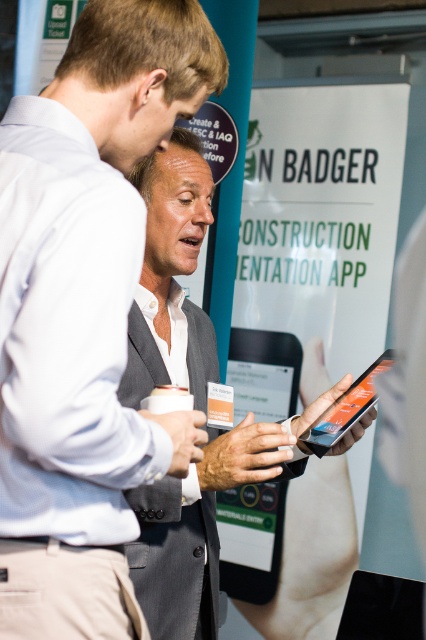
Question: Which point appears farthest from the camera in this image?

Choices:
 (A) (117, 493)
 (B) (270, 544)

Answer: (B)

Question: Is gray suit jacket at center to the right of black matte tablet at center from the viewer's perspective?

Choices:
 (A) yes
 (B) no

Answer: (B)

Question: Is gray suit jacket at center smaller than black matte tablet at center?

Choices:
 (A) yes
 (B) no

Answer: (B)

Question: Which object is the closest to the gray suit jacket at center?

Choices:
 (A) black matte tablet at center
 (B) gray fabric suit at center

Answer: (B)

Question: Does gray suit jacket at center have a greater width compared to black matte tablet at center?

Choices:
 (A) no
 (B) yes

Answer: (B)

Question: Estimate the real-world distances between objects in this image. Which object is closer to the gray fabric suit at center?

Choices:
 (A) gray suit jacket at center
 (B) black matte tablet at center

Answer: (A)